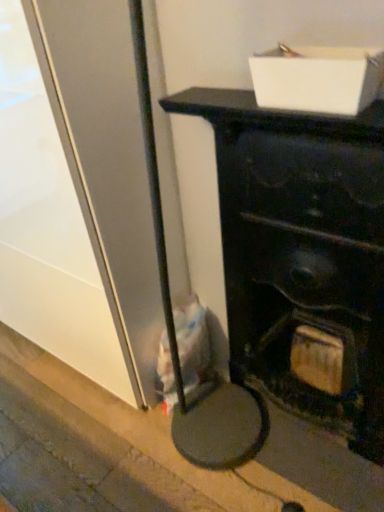
Identify the location of concrete at lower left. This screenshot has width=384, height=512. (117, 420).

The height and width of the screenshot is (512, 384). I want to click on concrete at lower left, so click(117, 420).

Is matte black fireplace at center oriented away from concrete at lower left?

No, matte black fireplace at center is not facing away from concrete at lower left.

From the picture: From the image's perspective, is matte black fireplace at center positioned above or below concrete at lower left?

matte black fireplace at center is above concrete at lower left.

Is matte black fireplace at center shorter than concrete at lower left?

In fact, matte black fireplace at center may be taller than concrete at lower left.

From a real-world perspective, who is located higher, white cardboard box at upper center or matte black fireplace at center?

white cardboard box at upper center.

Locate an element on the screen. cardboard box on the left side of matte black fireplace at center is located at coordinates (317, 78).

Based on the photo, considering the relative positions of white cardboard box at upper center and matte black fireplace at center in the image provided, is white cardboard box at upper center to the left of matte black fireplace at center from the viewer's perspective?

Yes, white cardboard box at upper center is to the left of matte black fireplace at center.

Is white cardboard box at upper center surrounding concrete at lower left?

No, concrete at lower left is not surrounded by white cardboard box at upper center.

Is point (329, 94) more distant than point (311, 477)?

No, (329, 94) is closer to viewer.

Does white cardboard box at upper center have a lesser width compared to concrete at lower left?

Yes.

From a real-world perspective, which is physically above, white cardboard box at upper center or concrete at lower left?

white cardboard box at upper center, from a real-world perspective.

From the image's perspective, which is above, concrete at lower left or white cardboard box at upper center?

white cardboard box at upper center, from the image's perspective.

There is a concrete at lower left. Where is `cardboard box above it (from a real-world perspective)`? cardboard box above it (from a real-world perspective) is located at coordinates (317, 78).

Which point is more distant from viewer, (x=69, y=387) or (x=289, y=64)?

The point (x=69, y=387) is behind.

Is white cardboard box at upper center a part of concrete at lower left?

No, white cardboard box at upper center is not surrounded by concrete at lower left.

How distant is matte black fireplace at center from white cardboard box at upper center?

matte black fireplace at center is 38.93 centimeters away from white cardboard box at upper center.

Consider the image. Does matte black fireplace at center have a lesser width compared to white cardboard box at upper center?

In fact, matte black fireplace at center might be wider than white cardboard box at upper center.

Is matte black fireplace at center facing away from white cardboard box at upper center?

No, matte black fireplace at center is not facing away from white cardboard box at upper center.

Is point (265, 190) closer or farther from the camera than point (280, 85)?

Point (265, 190).

Is concrete at lower left looking in the opposite direction of matte black fireplace at center?

No, concrete at lower left is not facing away from matte black fireplace at center.

Does point (265, 471) appear closer or farther from the camera than point (353, 431)?

Point (265, 471) is positioned farther from the camera compared to point (353, 431).

Does concrete at lower left have a greater width compared to matte black fireplace at center?

Yes.

Are concrete at lower left and matte black fireplace at center far apart?

No, concrete at lower left is not far from matte black fireplace at center.

Identify the location of pavement below the matte black fireplace at center (from the image's perspective). (117, 420).

Where is `furniture on the right of white cardboard box at upper center`? furniture on the right of white cardboard box at upper center is located at coordinates (302, 249).

Based on their spatial positions, is matte black fireplace at center or white cardboard box at upper center closer to concrete at lower left?

matte black fireplace at center is closer to concrete at lower left.

Based on their spatial positions, is concrete at lower left or matte black fireplace at center closer to white cardboard box at upper center?

matte black fireplace at center is closer to white cardboard box at upper center.

Which object lies nearer to the anchor point concrete at lower left, white cardboard box at upper center or matte black fireplace at center?

Answer: matte black fireplace at center.

When comparing their distances from white cardboard box at upper center, does matte black fireplace at center or concrete at lower left seem closer?

matte black fireplace at center lies closer to white cardboard box at upper center than the other object.

Looking at the image, which one is located further to matte black fireplace at center, concrete at lower left or white cardboard box at upper center?

concrete at lower left is further to matte black fireplace at center.

Which object lies further to the anchor point matte black fireplace at center, white cardboard box at upper center or concrete at lower left?

concrete at lower left lies further to matte black fireplace at center than the other object.

Identify the location of furniture between white cardboard box at upper center and concrete at lower left from top to bottom. (302, 249).